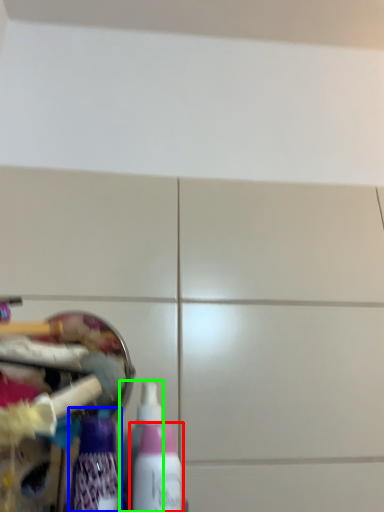
Question: Considering the real-world distances, which object is farthest from bottle (highlighted by a red box)? bottle (highlighted by a blue box) or bottle (highlighted by a green box)?

Choices:
 (A) bottle
 (B) bottle

Answer: (B)